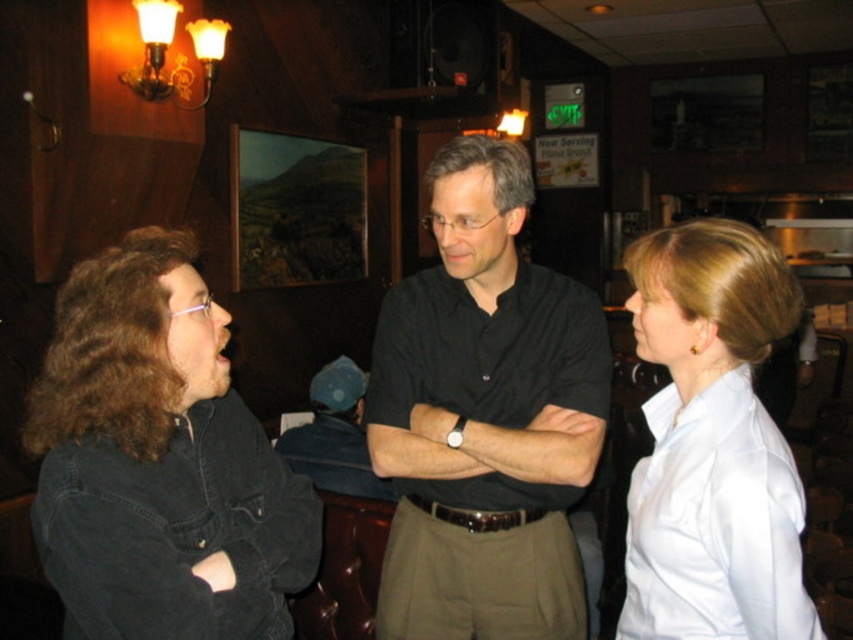
You are a photographer standing at the back of the room. You want to take a photo of both the black matte shirt at center and the denim jacket at lower left. Which one will appear larger in the photo?

The black matte shirt at center will appear larger in the photo because it is taller than the denim jacket at lower left.